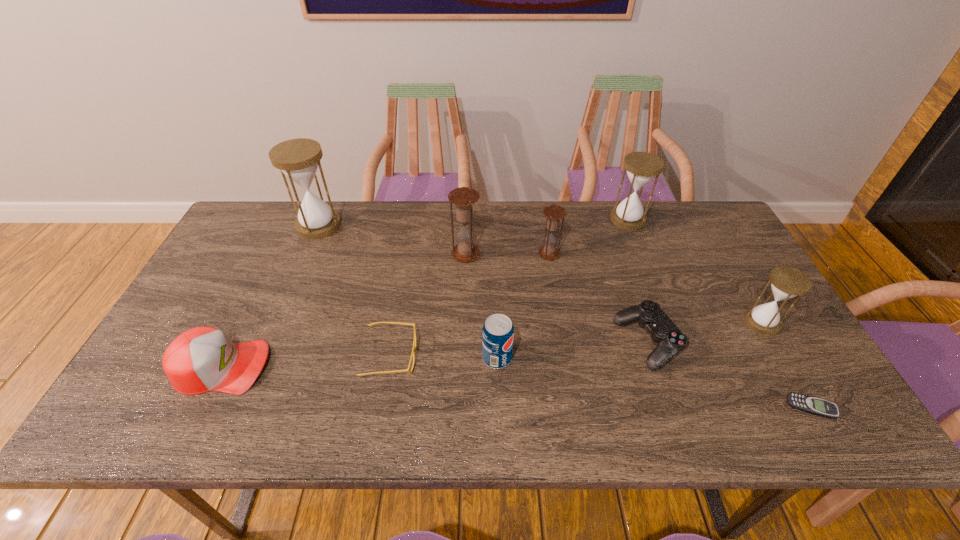
Identify the location of the third closest object to the second biggest white hourglass. The width and height of the screenshot is (960, 540). (787, 282).

Where is `the second closest hourglass to the second smallest white hourglass`? the second closest hourglass to the second smallest white hourglass is located at coordinates (787, 282).

You are a GUI agent. You are given a task and a screenshot of the screen. Output one action in this format:
    pyautogui.click(x=<x>, y=<y>)
    Task: Click on the hourglass that is the second closest to the baseball cap
    This screenshot has height=540, width=960.
    Given the screenshot: What is the action you would take?
    pyautogui.click(x=463, y=198)

You are a GUI agent. You are given a task and a screenshot of the screen. Output one action in this format:
    pyautogui.click(x=<x>, y=<y>)
    Task: Click on the white hourglass that stands as the closest to the gray beeper
    This screenshot has height=540, width=960.
    Given the screenshot: What is the action you would take?
    pyautogui.click(x=787, y=282)

Select which white hourglass appears as the second closest to the fourth hourglass from left to right. Please provide its 2D coordinates. Your answer should be formatted as a tuple, i.e. [(x, y)], where the tuple contains the x and y coordinates of a point satisfying the conditions above.

[(298, 159)]

Identify the location of vacant space that satisfies the following two spatial constraints: 1. in front of the lenses of the spectacles; 2. on the back side of the gray beeper. The width and height of the screenshot is (960, 540). (381, 407).

Identify the location of free space that satisfies the following two spatial constraints: 1. in front of the lenses of the beige spectacles; 2. on the back side of the beeper. This screenshot has width=960, height=540. point(381,407).